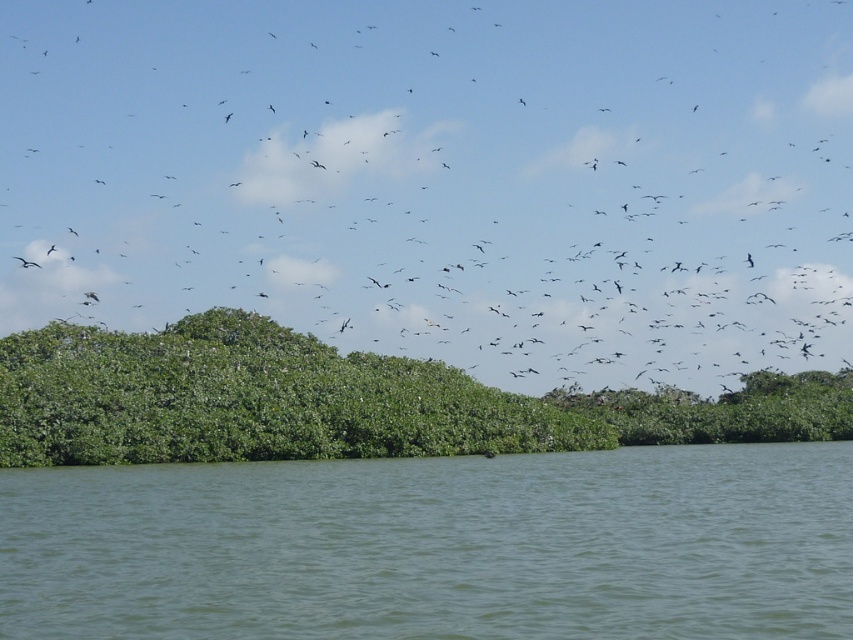
Question: Does green liquid water at lower center have a larger size compared to green leafy trees at center?

Choices:
 (A) no
 (B) yes

Answer: (A)

Question: In this image, where is green liquid water at lower center located relative to green leafy trees at center?

Choices:
 (A) above
 (B) below

Answer: (B)

Question: Which object is the farthest from the green leafy trees at center?

Choices:
 (A) black matte bird at center
 (B) green liquid water at lower center

Answer: (A)

Question: Which object appears farthest from the camera in this image?

Choices:
 (A) green liquid water at lower center
 (B) green leafy trees at center

Answer: (B)

Question: Can you confirm if black matte bird at center is wider than green liquid water at lower center?

Choices:
 (A) yes
 (B) no

Answer: (A)

Question: Which of the following is the farthest from the observer?

Choices:
 (A) (27, 509)
 (B) (427, 419)

Answer: (B)